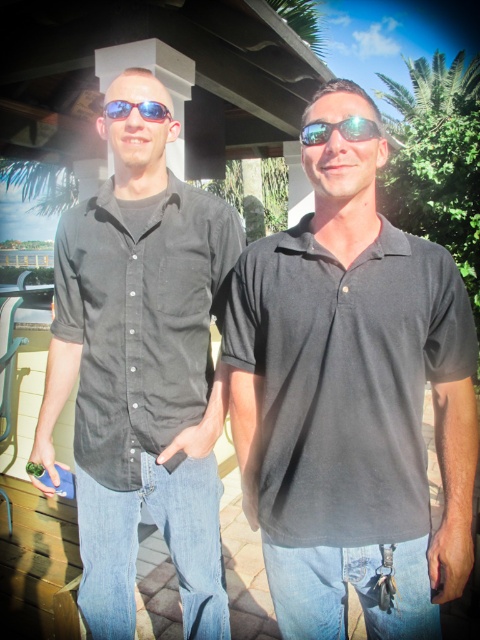
Which is more to the right, matte black shirt at left or sunglasses at center?

sunglasses at center

Is point (159, 364) farther from viewer compared to point (381, 131)?

Yes, point (159, 364) is farther from viewer.

Who is more forward, (73, 253) or (380, 129)?

Point (380, 129) is in front.

Locate an element on the screen. matte black shirt at left is located at coordinates (142, 378).

Which is in front, point (448, 365) or point (326, 132)?

Point (326, 132)

Who is positioned more to the right, black cotton polo shirt at center or sunglasses at center?

From the viewer's perspective, sunglasses at center appears more on the right side.

Between point (452, 336) and point (302, 131), which one is positioned in front?

Point (302, 131) is more forward.

At what (x,y) coordinates should I click in order to perform the action: click on black cotton polo shirt at center. Please return your answer as a coordinate pair (x, y). Looking at the image, I should click on (351, 406).

Does matte black shirt at left appear on the left side of matte black sunglasses at upper center?

Indeed, matte black shirt at left is positioned on the left side of matte black sunglasses at upper center.

Is point (104, 308) closer to viewer compared to point (166, 116)?

That is False.

At what (x,y) coordinates should I click in order to perform the action: click on matte black shirt at left. Please return your answer as a coordinate pair (x, y). Looking at the image, I should click on (142, 378).